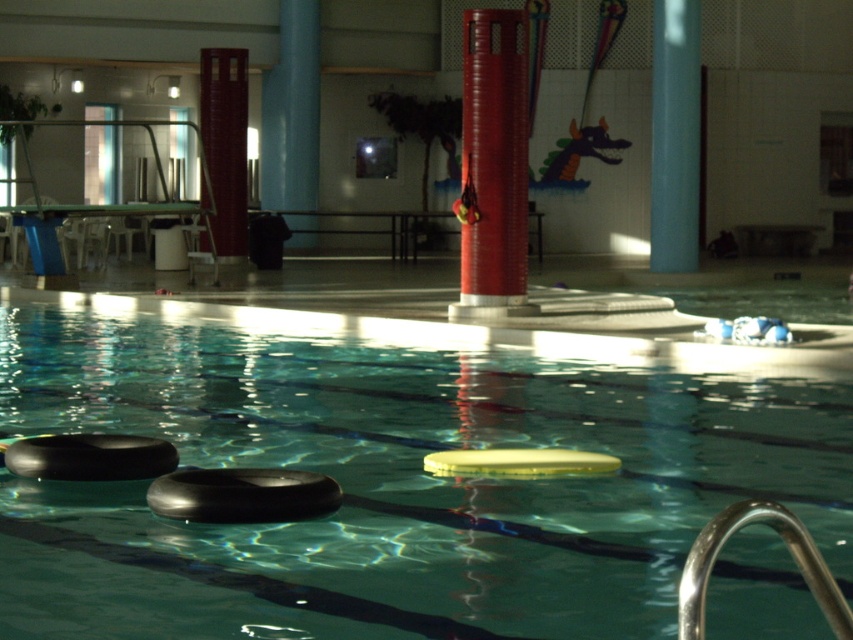
Can you confirm if red matte column at center is smaller than black rubber tire at center?

No.

Is red matte column at center positioned at the back of black rubber tire at center?

Yes, red matte column at center is further from the viewer.

This screenshot has width=853, height=640. What do you see at coordinates (492, 163) in the screenshot?
I see `red matte column at center` at bounding box center [492, 163].

At what (x,y) coordinates should I click in order to perform the action: click on red matte column at center. Please return your answer as a coordinate pair (x, y). The height and width of the screenshot is (640, 853). Looking at the image, I should click on (492, 163).

Who is shorter, red matte column at center or blue glossy pole at upper center?

blue glossy pole at upper center

Can you confirm if red matte column at center is positioned above blue glossy pole at upper center?

No.

Between point (463, 301) and point (666, 269), which one is positioned behind?

The point (666, 269) is behind.

This screenshot has width=853, height=640. What are the coordinates of `red matte column at center` in the screenshot? It's located at (492, 163).

Can you confirm if blue smooth pole at center is positioned above black rubber tire at center?

Yes, blue smooth pole at center is above black rubber tire at center.

Who is shorter, blue smooth pole at center or black rubber tire at center?

black rubber tire at center

Identify the location of blue smooth pole at center. (292, 113).

Find the location of a particular element. This screenshot has height=640, width=853. blue smooth pole at center is located at coordinates (292, 113).